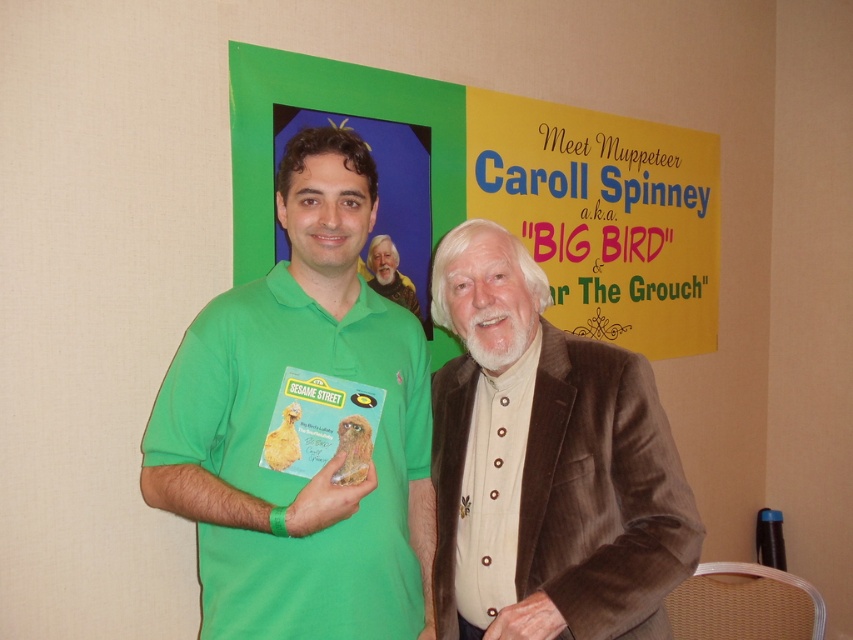
Consider the image. Does green matte poster at upper center have a larger size compared to brown corduroy suit at center?

Yes, green matte poster at upper center is bigger than brown corduroy suit at center.

Which is behind, point (408, 236) or point (535, 545)?

The point (408, 236) is more distant.

Identify the location of green matte poster at upper center. (498, 192).

Does green cotton shirt at center appear on the left side of brown corduroy suit at center?

Indeed, green cotton shirt at center is positioned on the left side of brown corduroy suit at center.

Identify the location of green cotton shirt at center. Image resolution: width=853 pixels, height=640 pixels. (265, 428).

Identify the location of green cotton shirt at center. (265, 428).

Who is positioned more to the right, green cotton shirt at center or green matte poster at upper center?

Positioned to the right is green matte poster at upper center.

Is point (267, 508) farther from camera compared to point (515, 99)?

No, (267, 508) is in front of (515, 99).

Locate an element on the screen. The image size is (853, 640). green cotton shirt at center is located at coordinates (265, 428).